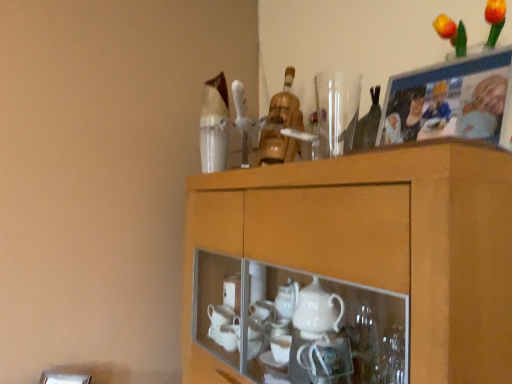
Question: Is transparent glass vase at upper center shorter than wooden photo frame at upper right?

Choices:
 (A) yes
 (B) no

Answer: (A)

Question: From a real-world perspective, is transparent glass vase at upper center physically below wooden photo frame at upper right?

Choices:
 (A) no
 (B) yes

Answer: (A)

Question: From the image's perspective, would you say transparent glass vase at upper center is shown under wooden photo frame at upper right?

Choices:
 (A) yes
 (B) no

Answer: (B)

Question: Considering the relative sizes of transparent glass vase at upper center and wooden photo frame at upper right in the image provided, is transparent glass vase at upper center wider than wooden photo frame at upper right?

Choices:
 (A) yes
 (B) no

Answer: (A)

Question: Is transparent glass vase at upper center not inside wooden photo frame at upper right?

Choices:
 (A) no
 (B) yes

Answer: (B)

Question: Is point (214, 279) positioned closer to the camera than point (349, 102)?

Choices:
 (A) farther
 (B) closer

Answer: (A)

Question: Is wooden cabinet at upper center spatially inside transparent glass vase at upper center, or outside of it?

Choices:
 (A) outside
 (B) inside

Answer: (A)

Question: From a real-world perspective, is wooden cabinet at upper center positioned above or below transparent glass vase at upper center?

Choices:
 (A) below
 (B) above

Answer: (A)

Question: Considering the relative positions of wooden cabinet at upper center and transparent glass vase at upper center in the image provided, is wooden cabinet at upper center to the left or to the right of transparent glass vase at upper center?

Choices:
 (A) right
 (B) left

Answer: (B)

Question: From their relative heights in the image, would you say transparent glass vase at upper center is taller or shorter than wooden photo frame at upper right?

Choices:
 (A) tall
 (B) short

Answer: (B)

Question: From a real-world perspective, is transparent glass vase at upper center positioned above or below wooden photo frame at upper right?

Choices:
 (A) above
 (B) below

Answer: (A)

Question: Do you think transparent glass vase at upper center is within wooden photo frame at upper right, or outside of it?

Choices:
 (A) inside
 (B) outside

Answer: (B)

Question: Is transparent glass vase at upper center bigger or smaller than wooden photo frame at upper right?

Choices:
 (A) big
 (B) small

Answer: (B)

Question: Is wooden photo frame at upper right bigger or smaller than wooden cabinet at upper center?

Choices:
 (A) small
 (B) big

Answer: (A)

Question: Is wooden photo frame at upper right spatially inside wooden cabinet at upper center, or outside of it?

Choices:
 (A) inside
 (B) outside

Answer: (B)